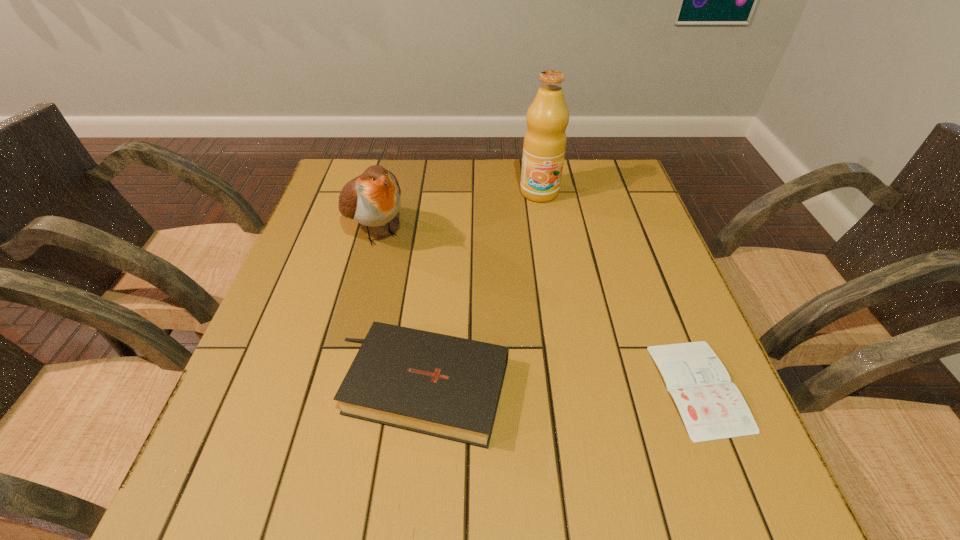
This screenshot has height=540, width=960. I want to click on vacant position located at the face of the bird, so click(x=472, y=343).

The image size is (960, 540). I want to click on vacant space located at the face of the bird, so click(x=435, y=302).

This screenshot has width=960, height=540. I want to click on vacant point located 0.350m on the front label of the tallest object, so click(551, 298).

Image resolution: width=960 pixels, height=540 pixels. Find the location of `free spot located on the front label of the tallest object`. free spot located on the front label of the tallest object is located at coordinates (551, 298).

What are the coordinates of `vacant space located on the front label of the tallest object` in the screenshot? It's located at [x=546, y=255].

Identify the location of object at the far edge. (544, 146).

Locate an element on the screen. Bible situated at the near edge is located at coordinates (449, 387).

Identify the location of diary located in the near edge section of the desktop. pos(712,408).

Image resolution: width=960 pixels, height=540 pixels. I want to click on object present at the left edge, so click(373, 199).

Where is `object present at the right edge`? Image resolution: width=960 pixels, height=540 pixels. object present at the right edge is located at coordinates point(712,408).